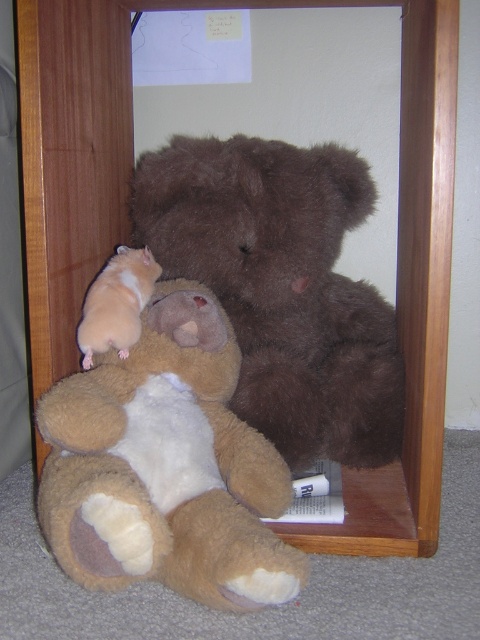
You are a child who wants to reach the hamster on the light brown fur hamster at left. The brown plush teddy bear at center is blocking your way. Can you move the teddy bear to get to the hamster?

The brown plush teddy bear at center is located above the light brown fur hamster at left, so you can move the teddy bear to access the hamster.

You are a child trying to reach two points in the image. The first point is at coordinate point(141, 493) and the second point is at coordinate point(252, 292). Which point is closer to you?

Point(141, 493) is closer to the viewer than point(252, 292).

You are a child trying to decide which hamster to pick up first. The light brown plush hamster at lower left and the light brown fur hamster at left are both on the shelf. Which hamster is taller?

The light brown plush hamster at lower left is taller than the light brown fur hamster at left.